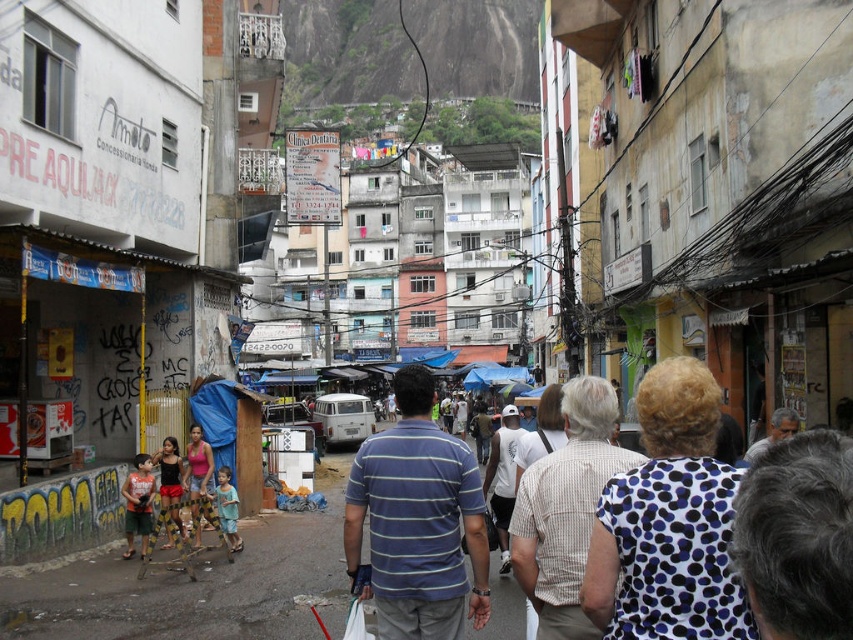
Question: Is beige striped shirt at center positioned before pink fabric shorts at lower left?

Choices:
 (A) no
 (B) yes

Answer: (B)

Question: Does beige striped shirt at center have a lesser width compared to matte black shorts at lower left?

Choices:
 (A) no
 (B) yes

Answer: (A)

Question: Which object appears farthest from the camera in this image?

Choices:
 (A) blue striped shirt at center
 (B) white dotted shirt at center
 (C) pink fabric shorts at lower left

Answer: (C)

Question: Which point is closer to the camera?

Choices:
 (A) pink fabric shorts at lower left
 (B) light blue striped shirt at center
 (C) orange striped shirt at center

Answer: (C)

Question: Which of the following is the closest to the observer?

Choices:
 (A) (537, 634)
 (B) (160, 470)
 (C) (138, 512)

Answer: (A)

Question: Is blue striped shirt at center smaller than matte black shorts at lower left?

Choices:
 (A) no
 (B) yes

Answer: (A)